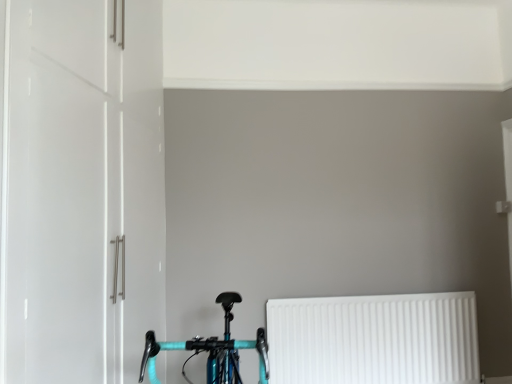
Describe the element at coordinates (79, 189) in the screenshot. I see `white glossy cabinet at left` at that location.

Where is `white plastic radiator at lower right`? white plastic radiator at lower right is located at coordinates (374, 339).

From the picture: Between white plastic radiator at lower right and teal glossy bicycle at lower center, which one is positioned in front?

teal glossy bicycle at lower center is in front.

Is white plastic radiator at lower right looking in the opposite direction of teal glossy bicycle at lower center?

That's not correct — white plastic radiator at lower right is not looking away from teal glossy bicycle at lower center.

Considering the positions of objects white plastic radiator at lower right and teal glossy bicycle at lower center in the image provided, who is more to the right, white plastic radiator at lower right or teal glossy bicycle at lower center?

From the viewer's perspective, white plastic radiator at lower right appears more on the right side.

Locate an element on the screen. The width and height of the screenshot is (512, 384). bicycle located above the white plastic radiator at lower right (from the image's perspective) is located at coordinates (212, 350).

From the image's perspective, which object appears higher, teal glossy bicycle at lower center or white plastic radiator at lower right?

teal glossy bicycle at lower center is shown above in the image.

Does teal glossy bicycle at lower center have a smaller size compared to white plastic radiator at lower right?

No.

Is teal glossy bicycle at lower center not within white plastic radiator at lower right?

Absolutely, teal glossy bicycle at lower center is external to white plastic radiator at lower right.

From a real-world perspective, is white glossy cabinet at left physically located above or below teal glossy bicycle at lower center?

In terms of real-world spatial position, white glossy cabinet at left is above teal glossy bicycle at lower center.

Is there a large distance between white glossy cabinet at left and teal glossy bicycle at lower center?

No, there isn't a large distance between white glossy cabinet at left and teal glossy bicycle at lower center.

Considering the sizes of white glossy cabinet at left and teal glossy bicycle at lower center in the image, is white glossy cabinet at left taller or shorter than teal glossy bicycle at lower center?

In the image, white glossy cabinet at left appears to be taller than teal glossy bicycle at lower center.

From the picture: Would you say white glossy cabinet at left is inside or outside teal glossy bicycle at lower center?

white glossy cabinet at left is outside teal glossy bicycle at lower center.

Considering the positions of objects teal glossy bicycle at lower center and white glossy cabinet at left in the image provided, who is behind, teal glossy bicycle at lower center or white glossy cabinet at left?

white glossy cabinet at left is further away from the camera.

From the image's perspective, which is above, teal glossy bicycle at lower center or white glossy cabinet at left?

white glossy cabinet at left appears higher in the image.

What's the angular difference between white glossy cabinet at left and white plastic radiator at lower right's facing directions?

The angular difference between white glossy cabinet at left and white plastic radiator at lower right is 76.7 degrees.

Identify the location of radiator that appears below the white glossy cabinet at left (from the image's perspective). This screenshot has height=384, width=512. (374, 339).

Could you tell me if white glossy cabinet at left is turned towards white plastic radiator at lower right?

Yes, white glossy cabinet at left is aimed at white plastic radiator at lower right.

Consider the image. Is white glossy cabinet at left wider than white plastic radiator at lower right?

Correct, the width of white glossy cabinet at left exceeds that of white plastic radiator at lower right.

Considering the sizes of white plastic radiator at lower right and white glossy cabinet at left in the image, is white plastic radiator at lower right wider or thinner than white glossy cabinet at left?

white plastic radiator at lower right is thinner than white glossy cabinet at left.

Which object is further away from the camera, white plastic radiator at lower right or white glossy cabinet at left?

white plastic radiator at lower right is further away from the camera.

Is white plastic radiator at lower right not inside white glossy cabinet at left?

Indeed, white plastic radiator at lower right is completely outside white glossy cabinet at left.

Where is `door located above the white plastic radiator at lower right (from a real-world perspective)`? door located above the white plastic radiator at lower right (from a real-world perspective) is located at coordinates (79, 189).

Locate an element on the screen. Image resolution: width=512 pixels, height=384 pixels. radiator below the teal glossy bicycle at lower center (from the image's perspective) is located at coordinates (374, 339).

This screenshot has height=384, width=512. What are the coordinates of `bicycle on the left of the white plastic radiator at lower right` in the screenshot? It's located at (212, 350).

Estimate the real-world distances between objects in this image. Which object is further from white glossy cabinet at left, teal glossy bicycle at lower center or white plastic radiator at lower right?

Based on the image, white plastic radiator at lower right appears to be further to white glossy cabinet at left.

From the image, which object appears to be farther from teal glossy bicycle at lower center, white glossy cabinet at left or white plastic radiator at lower right?

white plastic radiator at lower right is positioned further to the anchor teal glossy bicycle at lower center.

From the picture: When comparing their distances from teal glossy bicycle at lower center, does white plastic radiator at lower right or white glossy cabinet at left seem further?

white plastic radiator at lower right is further to teal glossy bicycle at lower center.

Based on their spatial positions, is white glossy cabinet at left or teal glossy bicycle at lower center closer to white plastic radiator at lower right?

The object closer to white plastic radiator at lower right is teal glossy bicycle at lower center.

Considering their positions, is teal glossy bicycle at lower center positioned further to white plastic radiator at lower right than white glossy cabinet at left?

white glossy cabinet at left.

When comparing their distances from white glossy cabinet at left, does white plastic radiator at lower right or teal glossy bicycle at lower center seem closer?

Based on the image, teal glossy bicycle at lower center appears to be nearer to white glossy cabinet at left.

What are the coordinates of `door positioned between teal glossy bicycle at lower center and white plastic radiator at lower right from near to far` in the screenshot? It's located at (79, 189).